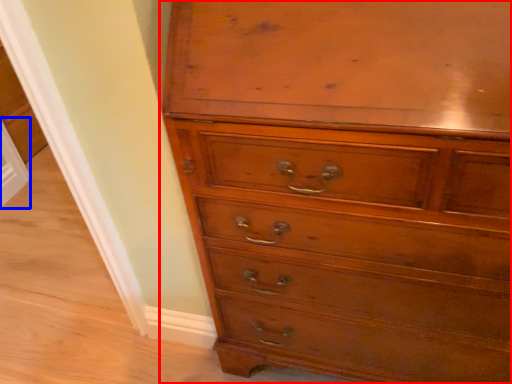
Question: Which object appears closest to the camera in this image, chest of drawers (highlighted by a red box) or screen door (highlighted by a blue box)?

Choices:
 (A) chest of drawers
 (B) screen door

Answer: (A)